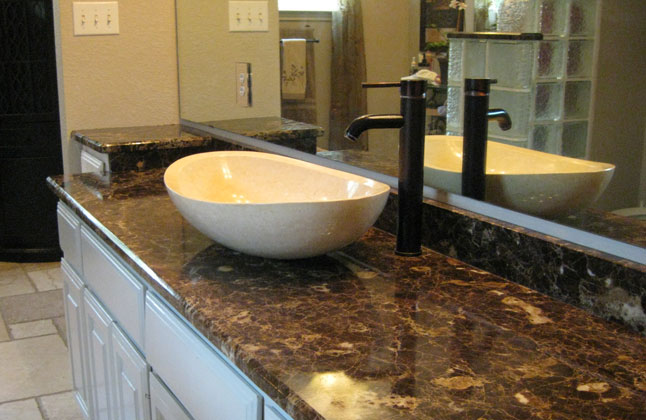
The image size is (646, 420). Find the location of `sink basin`. sink basin is located at coordinates (280, 214).